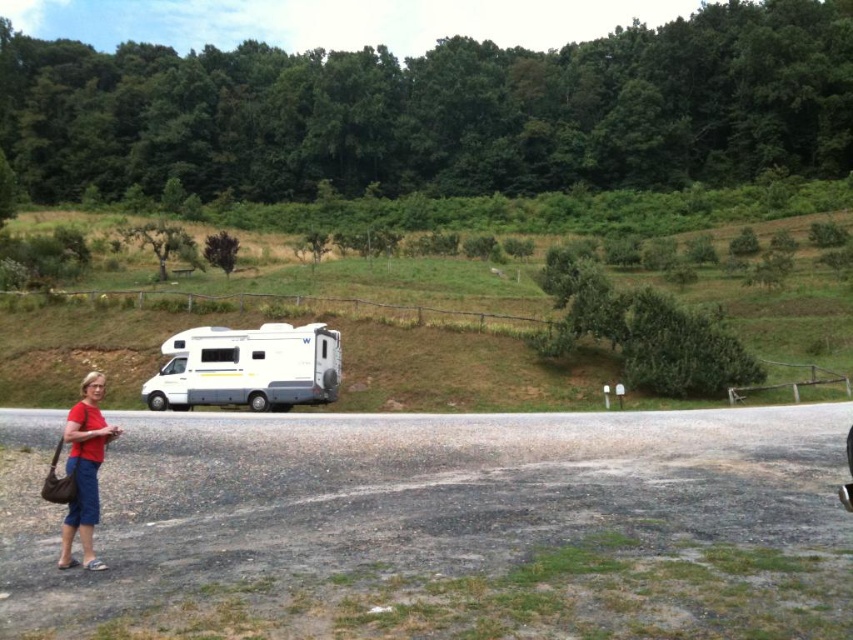
Does white glossy recreational vehicle at center come in front of matte red shirt at lower left?

No.

Can you confirm if white glossy recreational vehicle at center is smaller than matte red shirt at lower left?

Correct, white glossy recreational vehicle at center occupies less space than matte red shirt at lower left.

Between point (260, 381) and point (91, 449), which one is positioned behind?

Point (260, 381)

At what (x,y) coordinates should I click in order to perform the action: click on white glossy recreational vehicle at center. Please return your answer as a coordinate pair (x, y). The height and width of the screenshot is (640, 853). Looking at the image, I should click on (247, 368).